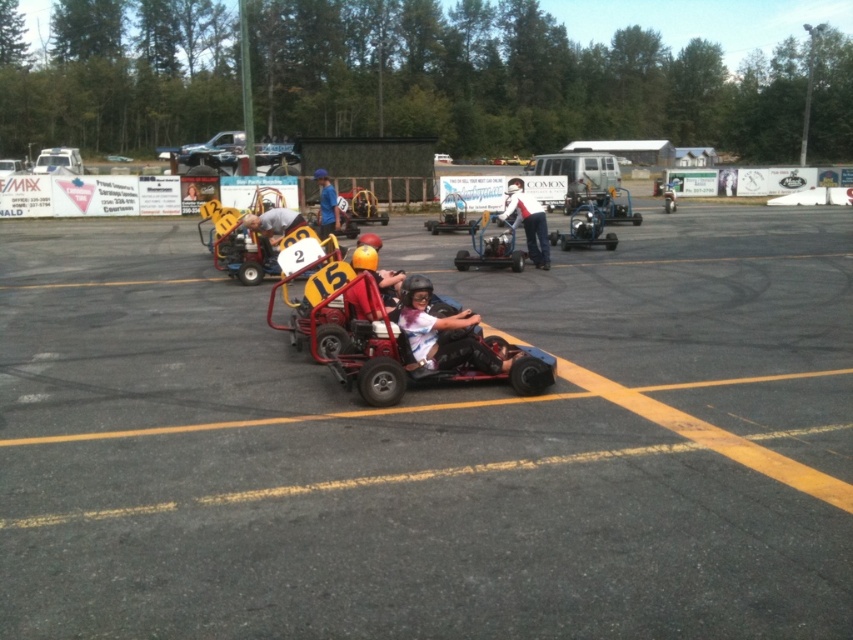
Between metallic silver van at center and white plastic car at upper left, which one is positioned lower?

Positioned lower is white plastic car at upper left.

Measure the distance between point (572, 184) and camera.

Point (572, 184) is 96.03 feet from camera.

The height and width of the screenshot is (640, 853). I want to click on metallic silver van at center, so click(579, 168).

Can you confirm if metallic silver van at center is thinner than metallic silver go-kart at center?

In fact, metallic silver van at center might be wider than metallic silver go-kart at center.

Can you confirm if metallic silver van at center is taller than metallic silver go-kart at center?

Yes.

Is point (575, 160) behind point (454, 202)?

Yes, it is behind point (454, 202).

This screenshot has width=853, height=640. I want to click on metallic silver van at center, so click(x=579, y=168).

Which is above, metallic red go-kart at center or white plastic car at upper left?

white plastic car at upper left is higher up.

Is metallic red go-kart at center closer to camera compared to white plastic car at upper left?

Yes, metallic red go-kart at center is closer to the viewer.

Image resolution: width=853 pixels, height=640 pixels. Identify the location of metallic red go-kart at center. (409, 339).